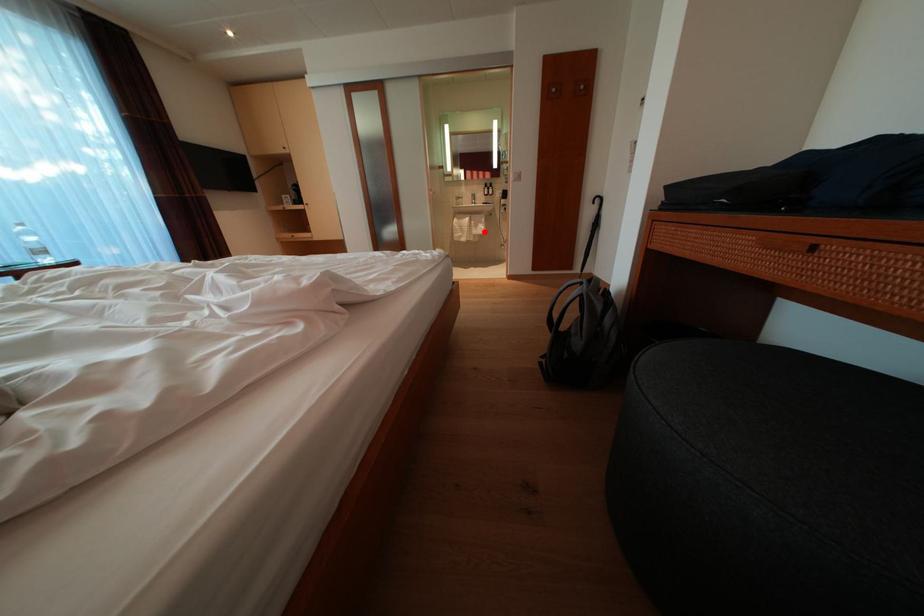
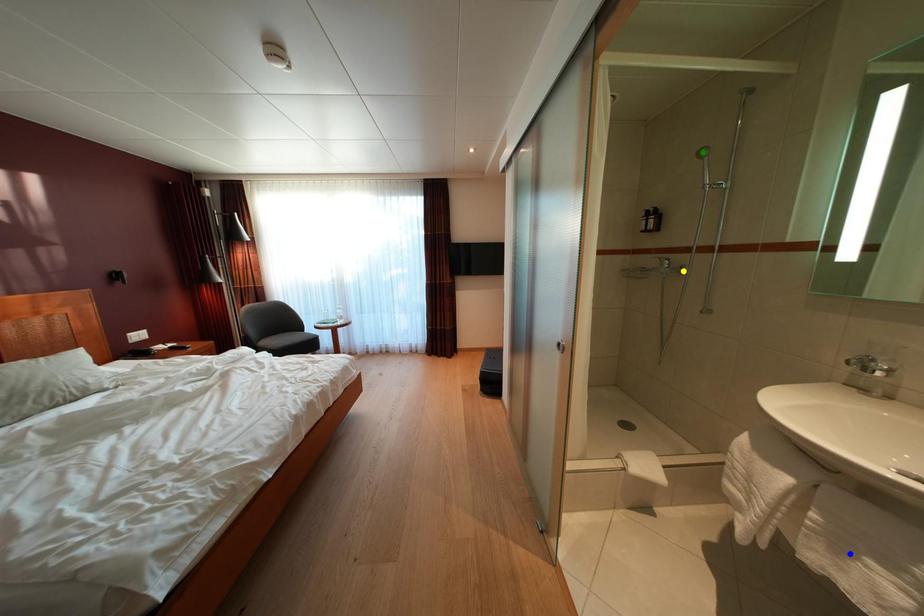
Question: I am providing you with two images of the same scene from different viewpoints. A red point is marked on the first image. You are given multiple points on the second image. Which point in image 2 represents the same 3d spot as the red point in image 1?

Choices:
 (A) green point
 (B) yellow point
 (C) blue point

Answer: (C)